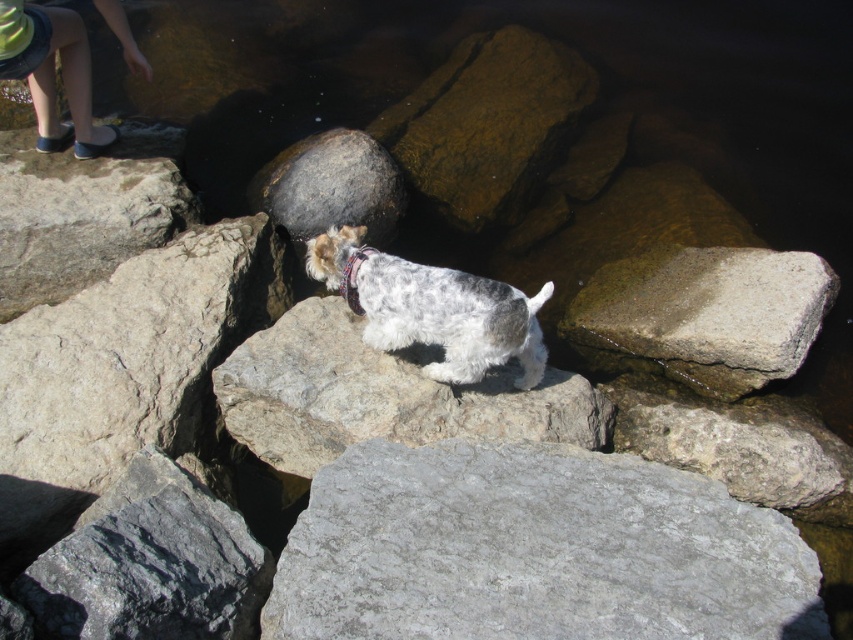
You are standing at the point labeled point (144, 531) and want to walk to the point labeled point (653, 262). Given that you can only move along the rocky surface shown in the scene, will you be moving towards or away from the dog?

You will be moving away from the dog because point (653, 262) is farther from the viewer than point (144, 531), and the dog is facing away from the camera towards the water.

You are standing near the small dog and want to place a small toy between the gray rough rock at lower left and the gray rough rock at center. Which rock should you move closer to ensure the toy is placed exactly halfway between them?

You should move closer to the gray rough rock at lower left because it is nearer to you than the gray rough rock at center. To place the toy halfway, you need to account for their distance from your current position.

You are a photographer trying to capture the small dog standing on the rocks. You notice the gray rough rock at center and the brown rough rock at center. Which rock should you focus on if you want to include the smaller rock in your closeup shot?

The gray rough rock at center is smaller than the brown rough rock at center, so you should focus on the gray rough rock at center for the closeup shot.